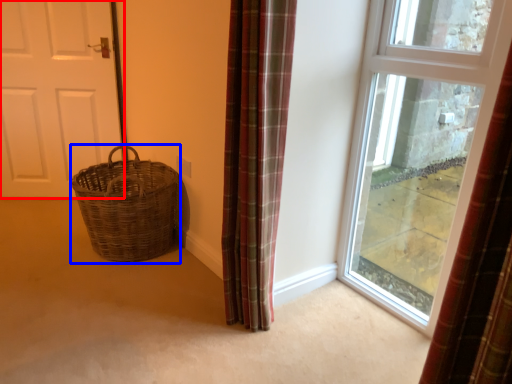
Question: Among these objects, which one is nearest to the camera, door (highlighted by a red box) or basket (highlighted by a blue box)?

Choices:
 (A) door
 (B) basket

Answer: (B)